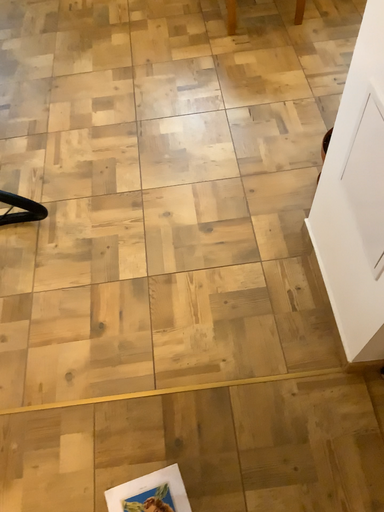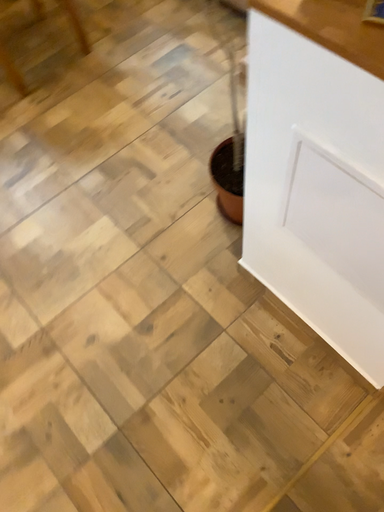
Question: Which way did the camera rotate in the video?

Choices:
 (A) rotated right
 (B) rotated left

Answer: (A)